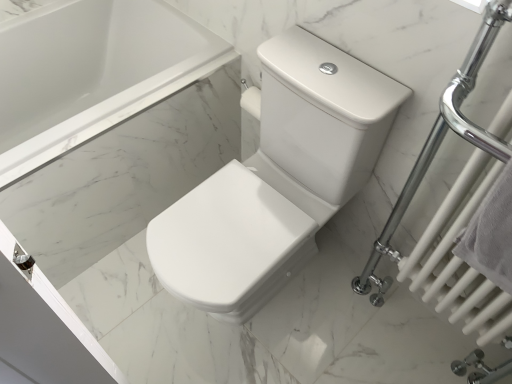
At what (x,y) coordinates should I click in order to perform the action: click on free area in between white glossy toilet at center and white glossy towel rack at right. Please return your answer as a coordinate pair (x, y). Looking at the image, I should click on (326, 349).